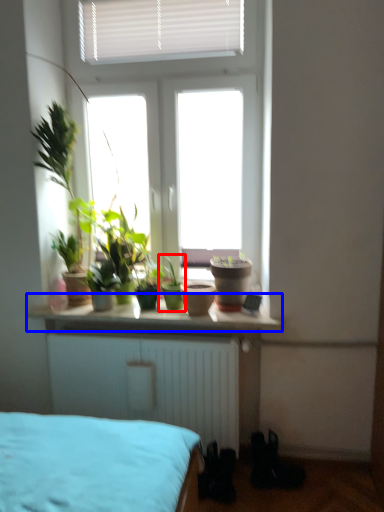
Question: Which object is further to the camera taking this photo, houseplant (highlighted by a red box) or counter top (highlighted by a blue box)?

Choices:
 (A) houseplant
 (B) counter top

Answer: (A)